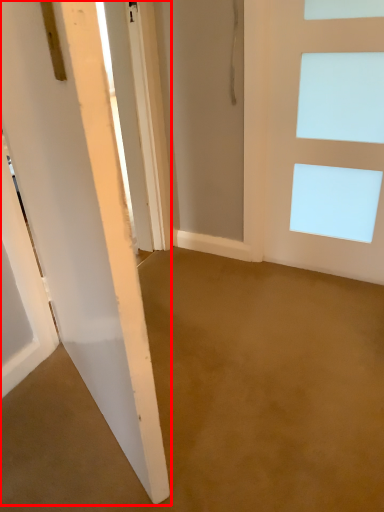
Question: Observing the image, what is the correct spatial positioning of door (annotated by the red box) in reference to door?

Choices:
 (A) right
 (B) left

Answer: (B)